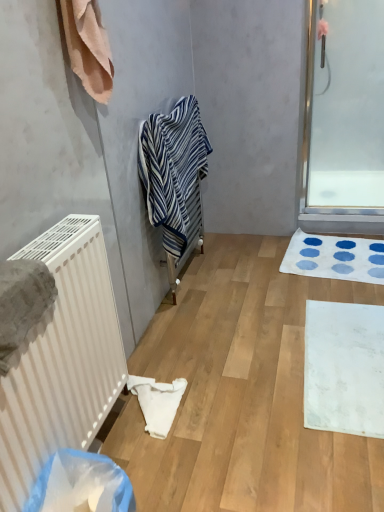
Question: Visually, is blue striped towel at center, acting as the first towel starting from the back, positioned to the left or to the right of white fabric towel at lower center?

Choices:
 (A) left
 (B) right

Answer: (B)

Question: Is blue striped towel at center, the 3th towel positioned from the front, in front of or behind white fabric towel at lower center in the image?

Choices:
 (A) front
 (B) behind

Answer: (B)

Question: Which object is the closest to the white fabric towel at lower center?

Choices:
 (A) white plastic radiator at left
 (B) white matte radiator at left
 (C) white matte bath mat at lower right, the 2th bath mat from the top
 (D) gray textured towel at left, positioned as the 1th towel in front-to-back order
 (E) beige cotton towel at upper left, marked as the second towel in a right-to-left arrangement

Answer: (B)

Question: Which is farther from the white plastic radiator at left?

Choices:
 (A) blue striped towel at center, which ranks as the first towel in right-to-left order
 (B) beige cotton towel at upper left, marked as the second towel in a right-to-left arrangement
 (C) transparent glass screen door at upper right
 (D) white matte radiator at left
 (E) white matte bath mat at lower right, the 2th bath mat from the top

Answer: (C)